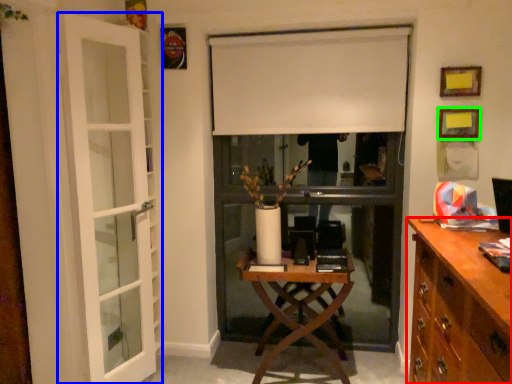
Question: Which object is positioned closest to cabinetry (highlighted by a red box)? Select from door (highlighted by a blue box) and picture frame (highlighted by a green box).

Choices:
 (A) door
 (B) picture frame

Answer: (B)